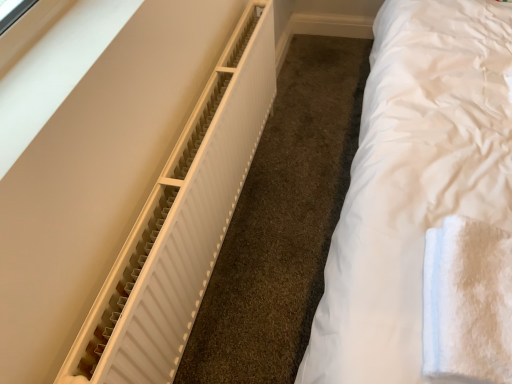
Question: Looking at their shapes, would you say white matte radiator at left is wider or thinner than white fluffy towel at right?

Choices:
 (A) wide
 (B) thin

Answer: (B)

Question: From a real-world perspective, is white matte radiator at left physically located above or below white fluffy towel at right?

Choices:
 (A) below
 (B) above

Answer: (A)

Question: Is white matte radiator at left inside or outside of white fluffy towel at right?

Choices:
 (A) inside
 (B) outside

Answer: (B)

Question: Looking at the image, does white fluffy towel at right seem bigger or smaller compared to white matte radiator at left?

Choices:
 (A) big
 (B) small

Answer: (B)

Question: From the image's perspective, relative to white matte radiator at left, is white fluffy towel at right above or below?

Choices:
 (A) above
 (B) below

Answer: (B)

Question: From a real-world perspective, is white fluffy towel at right positioned above or below white matte radiator at left?

Choices:
 (A) above
 (B) below

Answer: (A)

Question: Is white fluffy towel at right situated inside white matte radiator at left or outside?

Choices:
 (A) inside
 (B) outside

Answer: (B)